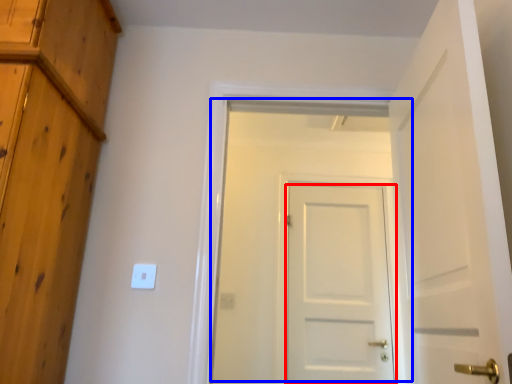
Question: Which of the following is the farthest to the observer, door (highlighted by a red box) or door (highlighted by a blue box)?

Choices:
 (A) door
 (B) door

Answer: (A)